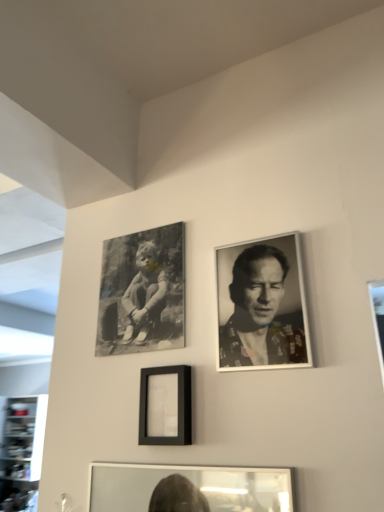
Question: Does matte black frame at center, arranged as the second picture frame when viewed from the back, have a greater width compared to black matte canvas at upper left, which appears as the 1th picture frame when viewed from the top?

Choices:
 (A) no
 (B) yes

Answer: (B)

Question: From the image's perspective, is matte black frame at center, the first picture frame when ordered from front to back, over black matte canvas at upper left, the second picture frame viewed from the front?

Choices:
 (A) yes
 (B) no

Answer: (B)

Question: Does matte black frame at center, the first picture frame when ordered from front to back, contain black matte canvas at upper left, the 2th picture frame in the bottom-to-top sequence?

Choices:
 (A) yes
 (B) no

Answer: (B)

Question: Is matte black frame at center, the first picture frame when ordered from front to back, at the right side of black matte canvas at upper left, the 2th picture frame in the bottom-to-top sequence?

Choices:
 (A) yes
 (B) no

Answer: (A)

Question: Is matte black frame at center, the first picture frame positioned from the bottom, oriented towards black matte canvas at upper left, the first picture frame in the back-to-front sequence?

Choices:
 (A) yes
 (B) no

Answer: (B)

Question: Looking at the image, does black matte canvas at upper left, the second picture frame viewed from the front, seem bigger or smaller compared to matte black frame at center, arranged as the second picture frame when viewed from the back?

Choices:
 (A) big
 (B) small

Answer: (A)

Question: Is black matte canvas at upper left, which appears as the 1th picture frame when viewed from the top, inside or outside of matte black frame at center, arranged as the second picture frame when viewed from the back?

Choices:
 (A) inside
 (B) outside

Answer: (B)

Question: In terms of width, does black matte canvas at upper left, the 2th picture frame in the bottom-to-top sequence, look wider or thinner when compared to matte black frame at center, the first picture frame positioned from the bottom?

Choices:
 (A) thin
 (B) wide

Answer: (A)

Question: From the image's perspective, relative to matte black frame at center, placed as the 2th picture frame when sorted from top to bottom, is black matte canvas at upper left, the second picture frame viewed from the front, above or below?

Choices:
 (A) below
 (B) above

Answer: (B)

Question: Based on their positions, is matte black frame at center, the first picture frame positioned from the bottom, located to the left or right of black matte canvas at upper left, the first picture frame in the back-to-front sequence?

Choices:
 (A) left
 (B) right

Answer: (B)

Question: Choose the correct answer: Is matte black frame at center, the first picture frame positioned from the bottom, inside black matte canvas at upper left, which appears as the 1th picture frame when viewed from the top, or outside it?

Choices:
 (A) inside
 (B) outside

Answer: (B)

Question: From a real-world perspective, relative to black matte canvas at upper left, the first picture frame in the back-to-front sequence, is matte black frame at center, the first picture frame when ordered from front to back, vertically above or below?

Choices:
 (A) above
 (B) below

Answer: (B)

Question: Considering the positions of matte black frame at center, placed as the 2th picture frame when sorted from top to bottom, and black matte canvas at upper left, the second picture frame viewed from the front, in the image, is matte black frame at center, placed as the 2th picture frame when sorted from top to bottom, taller or shorter than black matte canvas at upper left, the second picture frame viewed from the front,?

Choices:
 (A) short
 (B) tall

Answer: (A)

Question: In terms of height, does black and white portrait at upper right look taller or shorter compared to matte black frame at center, arranged as the second picture frame when viewed from the back?

Choices:
 (A) tall
 (B) short

Answer: (A)

Question: Relative to matte black frame at center, the first picture frame when ordered from front to back, is black and white portrait at upper right in front or behind?

Choices:
 (A) front
 (B) behind

Answer: (A)